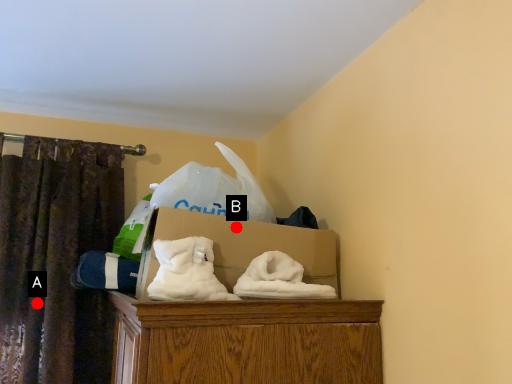
Question: Two points are circled on the image, labeled by A and B beside each circle. Which point is closer to the camera taking this photo?

Choices:
 (A) A is closer
 (B) B is closer

Answer: (B)